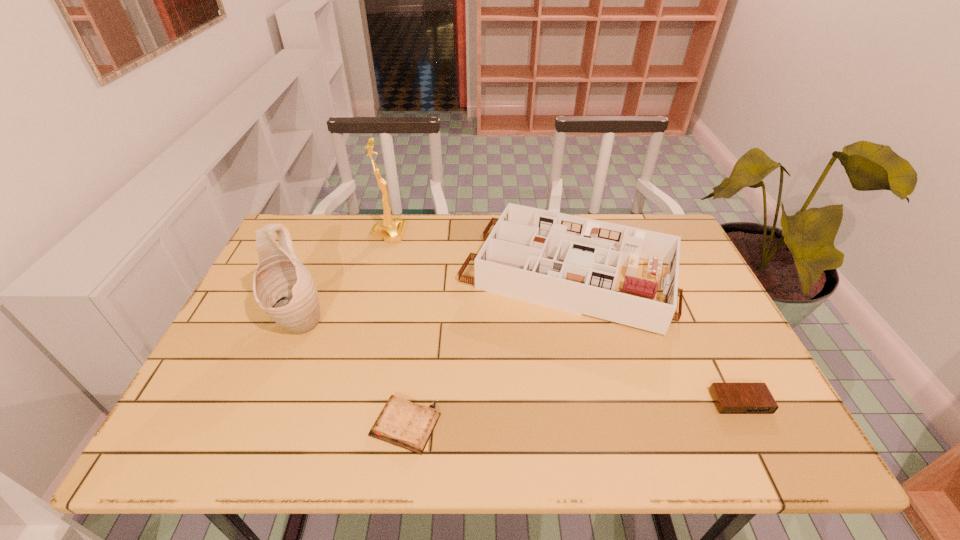
Image resolution: width=960 pixels, height=540 pixels. In order to click on vacant point located on the back of the shortest object in this screenshot , I will do `click(412, 379)`.

Locate an element on the screen. award that is at the far edge is located at coordinates (391, 230).

This screenshot has height=540, width=960. I want to click on dollhouse that is at the far edge, so click(x=569, y=263).

The height and width of the screenshot is (540, 960). What are the coordinates of `object present at the near edge` in the screenshot? It's located at (402, 423).

Locate an element on the screen. The image size is (960, 540). object at the left edge is located at coordinates (283, 287).

The image size is (960, 540). In order to click on dollhouse present at the right edge in this screenshot , I will do pyautogui.click(x=569, y=263).

I want to click on alarm clock at the right edge, so click(x=730, y=398).

Where is `object positioned at the far right corner`? object positioned at the far right corner is located at coordinates (569, 263).

Where is `vacant space at the far edge of the desktop`? vacant space at the far edge of the desktop is located at coordinates (343, 224).

Where is `vacant space at the near edge of the desktop`? vacant space at the near edge of the desktop is located at coordinates (256, 437).